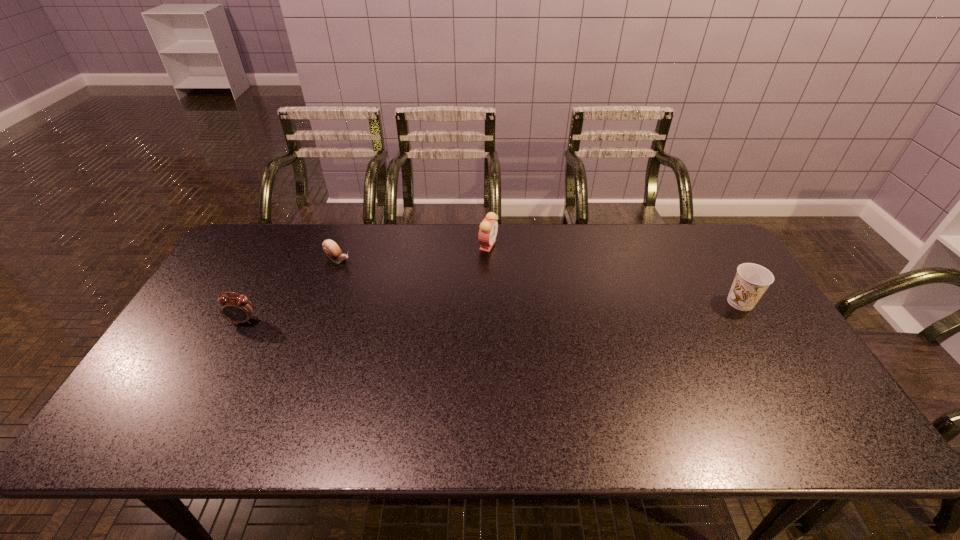
The image size is (960, 540). Identify the location of empty location between the second nearest object and the right alarm clock. (614, 274).

Where is `empty location between the third object from left to right and the third object from right to left`? This screenshot has height=540, width=960. empty location between the third object from left to right and the third object from right to left is located at coordinates [413, 252].

You are a GUI agent. You are given a task and a screenshot of the screen. Output one action in this format:
    pyautogui.click(x=<x>, y=<y>)
    Task: Click on the empty location between the escargot and the leftmost object
    
    Given the screenshot: What is the action you would take?
    pyautogui.click(x=291, y=290)

Find the location of `blank region between the farther alarm clock and the shortest object`. blank region between the farther alarm clock and the shortest object is located at coordinates click(413, 252).

This screenshot has height=540, width=960. Identify the location of vacant point located between the right alarm clock and the third object from right to left. (413, 252).

I want to click on vacant space in between the right alarm clock and the nearer alarm clock, so 366,283.

Select which object is the second closest to the farther alarm clock. Please provide its 2D coordinates. Your answer should be formatted as a tuple, i.e. [(x, y)], where the tuple contains the x and y coordinates of a point satisfying the conditions above.

[(751, 281)]

Point out which object is positioned as the third nearest to the nearer alarm clock. Please provide its 2D coordinates. Your answer should be formatted as a tuple, i.e. [(x, y)], where the tuple contains the x and y coordinates of a point satisfying the conditions above.

[(751, 281)]